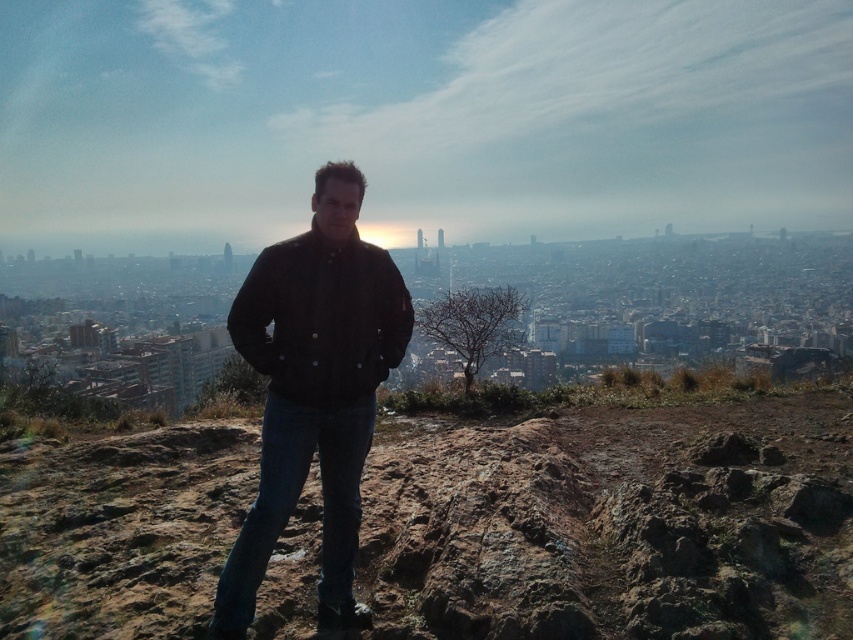
Question: Which point is farther to the camera?

Choices:
 (A) dark brown leather jacket at center
 (B) brown rocky hillside at center

Answer: (B)

Question: Is brown rocky hillside at center wider than dark brown leather jacket at center?

Choices:
 (A) no
 (B) yes

Answer: (B)

Question: Does brown rocky hillside at center appear under dark brown leather jacket at center?

Choices:
 (A) yes
 (B) no

Answer: (A)

Question: Which of the following is the closest to the observer?

Choices:
 (A) brown rocky hillside at center
 (B) dark brown leather jacket at center

Answer: (B)

Question: Among these objects, which one is nearest to the camera?

Choices:
 (A) brown rocky hillside at center
 (B) dark brown leather jacket at center

Answer: (B)

Question: Is the position of brown rocky hillside at center more distant than that of dark brown leather jacket at center?

Choices:
 (A) no
 (B) yes

Answer: (B)